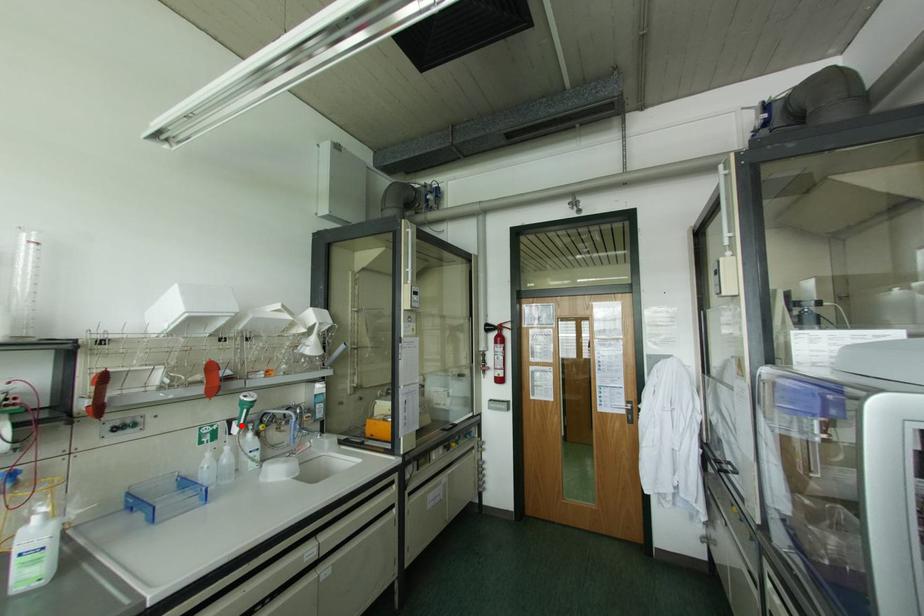
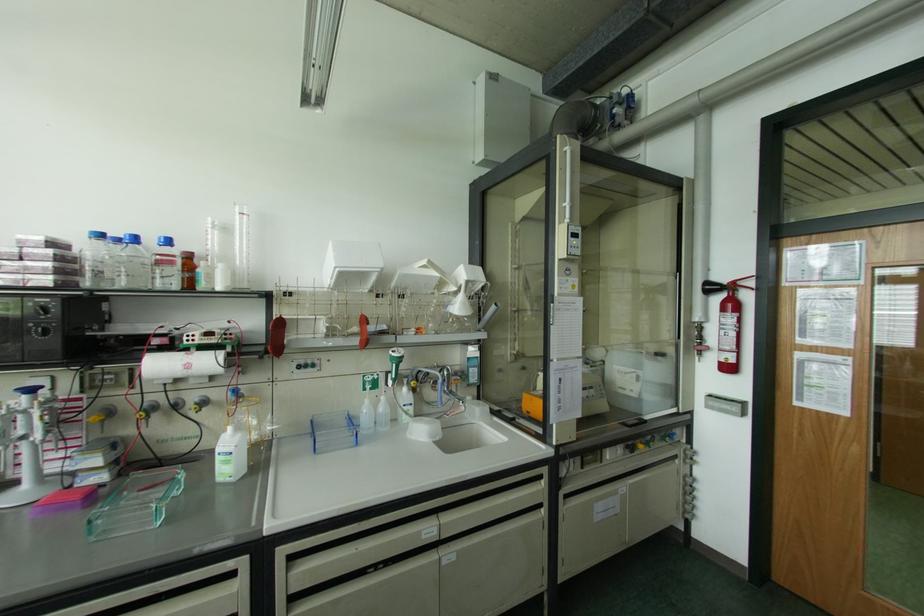
In the second image, find the point that corresponds to the highlighted location in the first image.

(394, 379)